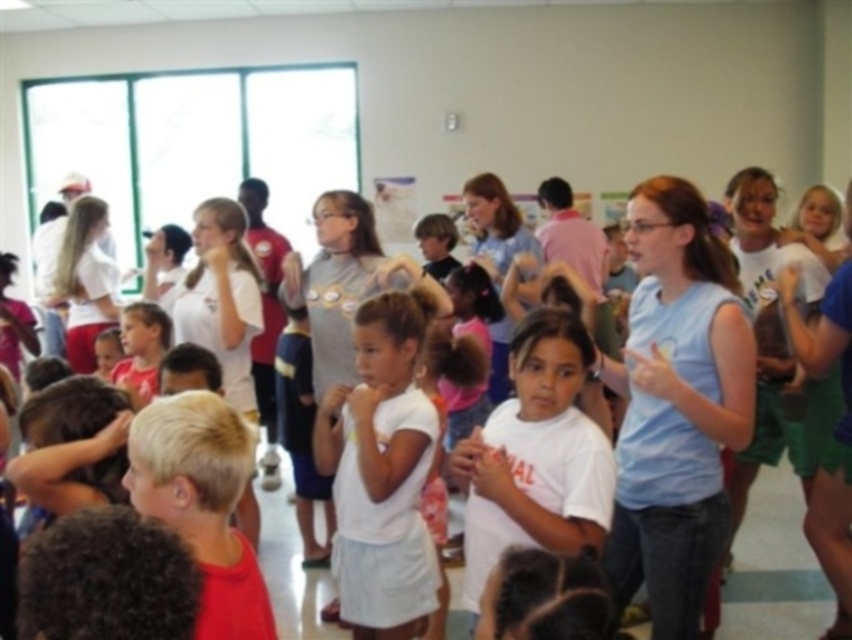
Who is more distant from viewer, (x=675, y=394) or (x=401, y=513)?

The point (x=401, y=513) is more distant.

Between point (678, 394) and point (338, 460), which one is positioned in front?

Positioned in front is point (678, 394).

At what (x,y) coordinates should I click in order to perform the action: click on light blue sleeveless shirt at center. Please return your answer as a coordinate pair (x, y). This screenshot has height=640, width=852. Looking at the image, I should click on (676, 404).

Does white matte shirt at center lie behind white cotton shirt at center?

That is False.

Is point (515, 440) more distant than point (390, 444)?

No, it is not.

Which is behind, point (499, 419) or point (375, 481)?

The point (375, 481) is more distant.

This screenshot has height=640, width=852. I want to click on white matte shirt at center, so click(534, 454).

Which is below, light blue sleeveless shirt at center or white matte shirt at center?

Positioned lower is white matte shirt at center.

Between light blue sleeveless shirt at center and white matte shirt at center, which one has less height?

white matte shirt at center is shorter.

Between point (655, 548) and point (563, 346), which one is positioned in front?

Point (563, 346)

Find the location of a particular element. light blue sleeveless shirt at center is located at coordinates (676, 404).